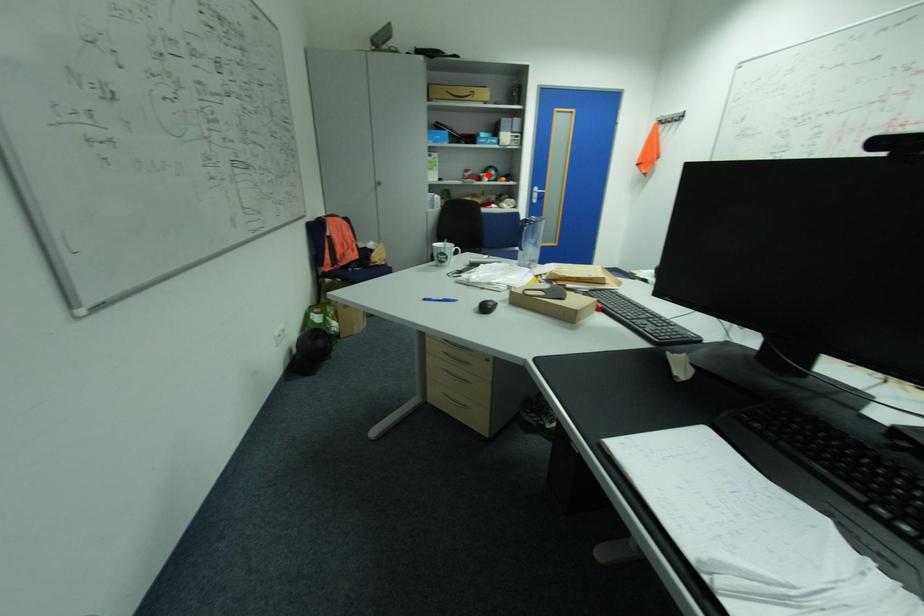
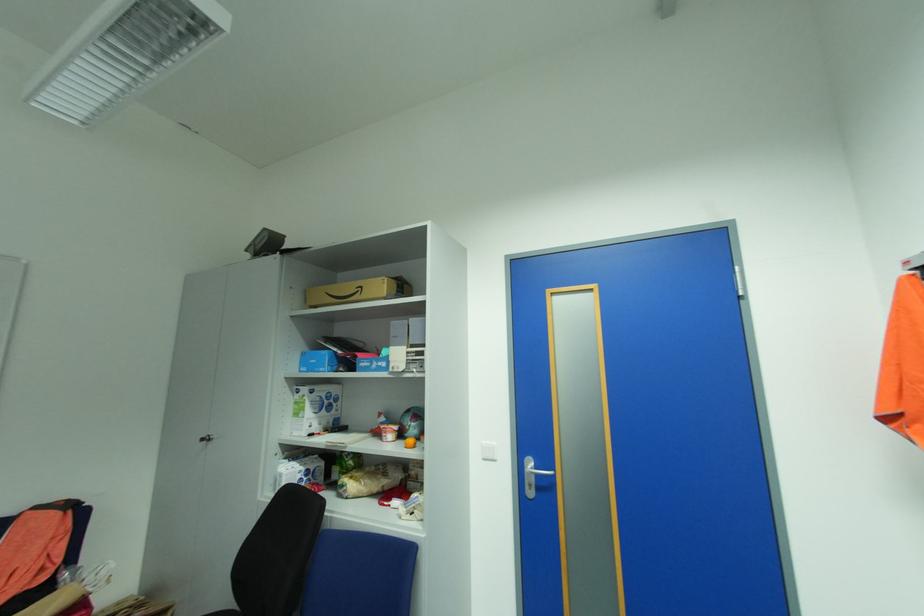
Question: A red point is marked in image1. In image2, is the corresponding 3D point closer to the camera or farther? Reply with the corresponding letter.

Choices:
 (A) The corresponding 3D point is closer.
 (B) The corresponding 3D point is farther.

Answer: (B)